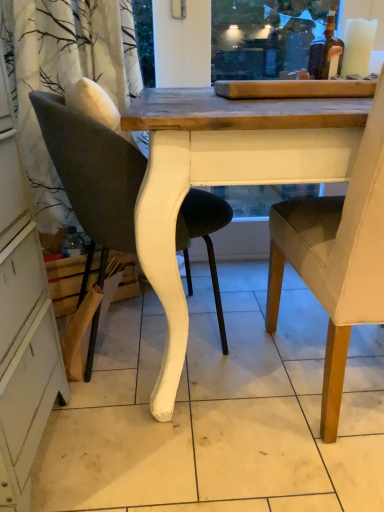
Identify the location of free point below light brown fabric chair at right, the 2th chair in the left-to-right sequence (from a real-world perspective). This screenshot has height=512, width=384. (341, 390).